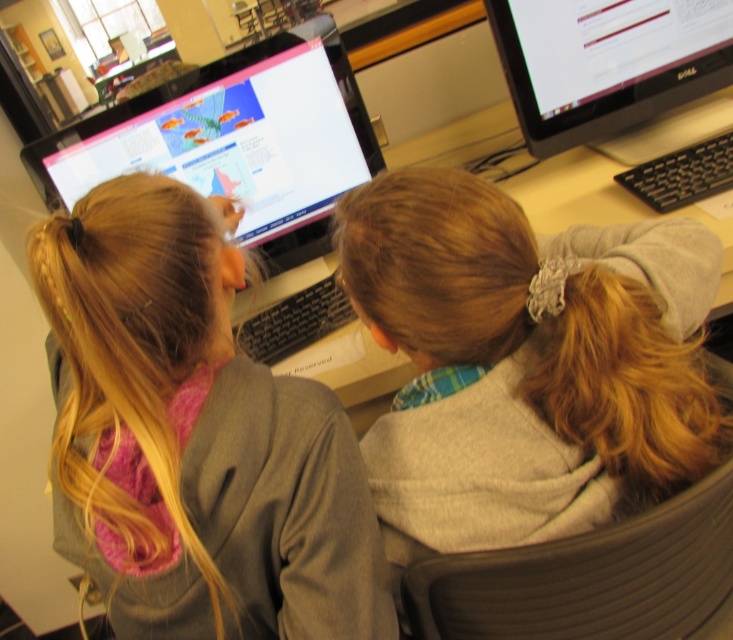
Question: Observing the image, what is the correct spatial positioning of black glossy monitor at upper right in reference to matte plastic computer desk at center?

Choices:
 (A) below
 (B) above

Answer: (B)

Question: Is black glossy monitor at upper right closer to camera compared to matte plastic computer desk at center?

Choices:
 (A) yes
 (B) no

Answer: (B)

Question: Which point is closer to the camera?

Choices:
 (A) gray fabric ponytail at center
 (B) black glossy monitor at upper right
 (C) gray sweater at center

Answer: (C)

Question: Which point is farther to the camera?

Choices:
 (A) black glossy monitor at upper right
 (B) gray sweater at center
 (C) gray fabric ponytail at center

Answer: (A)

Question: Among these points, which one is farthest from the camera?

Choices:
 (A) (360, 378)
 (B) (323, 561)
 (C) (408, 420)

Answer: (A)

Question: Can you confirm if gray sweater at center is thinner than black glossy monitor at upper right?

Choices:
 (A) no
 (B) yes

Answer: (B)